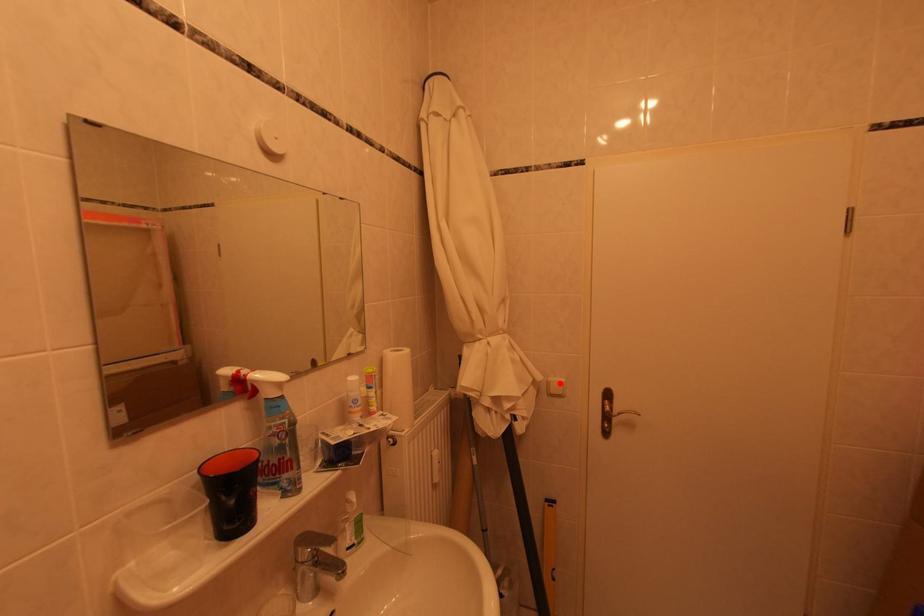
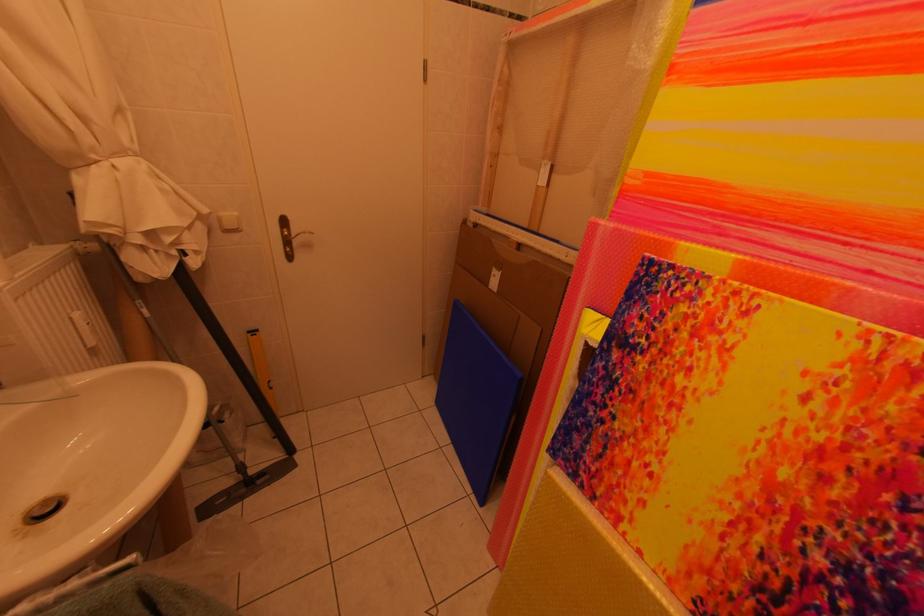
Locate, in the second image, the point that corresponds to the highlighted location in the first image.

(229, 217)